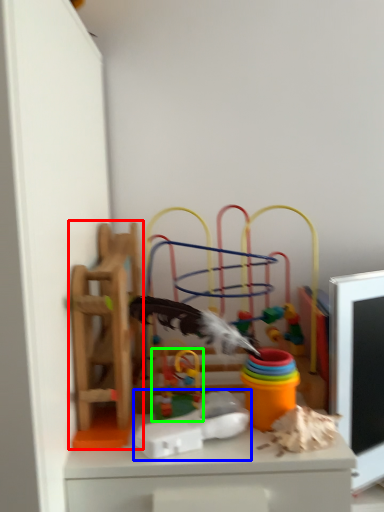
Question: Considering the real-world distances, which object is closest to toy (highlighted by a red box)? toy (highlighted by a blue box) or toy (highlighted by a green box).

Choices:
 (A) toy
 (B) toy

Answer: (B)